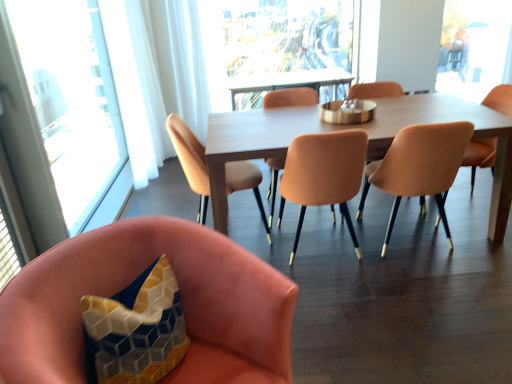
Question: Does matte orange chair at center, which is counted as the 3th chair, starting from the left, lie in front of matte peach armchair at center?

Choices:
 (A) no
 (B) yes

Answer: (B)

Question: Is matte peach armchair at center surrounded by matte orange chair at center, which is counted as the 3th chair, starting from the left?

Choices:
 (A) no
 (B) yes

Answer: (A)

Question: Considering the relative sizes of matte orange chair at center, which is counted as the 3th chair, starting from the left, and matte peach armchair at center in the image provided, is matte orange chair at center, which is counted as the 3th chair, starting from the left, bigger than matte peach armchair at center?

Choices:
 (A) no
 (B) yes

Answer: (A)

Question: Does matte orange chair at center, the 4th chair in the right-to-left sequence, have a greater height compared to matte peach armchair at center?

Choices:
 (A) no
 (B) yes

Answer: (A)

Question: Can you confirm if matte orange chair at center, the 4th chair in the right-to-left sequence, is wider than matte peach armchair at center?

Choices:
 (A) no
 (B) yes

Answer: (A)

Question: In the image, is transparent glass window at left, positioned as the 2th window in right-to-left order, positioned in front of or behind matte orange chair at center, which is counted as the fifth chair, starting from the left?

Choices:
 (A) behind
 (B) front

Answer: (B)

Question: Is transparent glass window at left, the second window positioned from the back, wider or thinner than matte orange chair at center, which is counted as the fifth chair, starting from the left?

Choices:
 (A) thin
 (B) wide

Answer: (A)

Question: Based on their sizes in the image, would you say transparent glass window at left, the first window from the left, is bigger or smaller than matte orange chair at center, which is counted as the fifth chair, starting from the left?

Choices:
 (A) small
 (B) big

Answer: (B)

Question: From a real-world perspective, is transparent glass window at left, the second window positioned from the back, positioned above or below matte orange chair at center, which appears as the second chair when viewed from the right?

Choices:
 (A) above
 (B) below

Answer: (A)

Question: Considering the relative positions of light brown wooden table at center and matte orange chair at center, which is counted as the fifth chair, starting from the left, in the image provided, is light brown wooden table at center to the left or to the right of matte orange chair at center, which is counted as the fifth chair, starting from the left,?

Choices:
 (A) left
 (B) right

Answer: (A)

Question: Is light brown wooden table at center inside or outside of matte orange chair at center, which is counted as the fifth chair, starting from the left?

Choices:
 (A) inside
 (B) outside

Answer: (B)

Question: From the image's perspective, relative to matte orange chair at center, which is counted as the fifth chair, starting from the left, is light brown wooden table at center above or below?

Choices:
 (A) above
 (B) below

Answer: (A)

Question: Is point (207, 157) positioned closer to the camera than point (442, 163)?

Choices:
 (A) farther
 (B) closer

Answer: (A)

Question: From the image's perspective, is matte orange chair at center, which is counted as the 3th chair, starting from the left, above or below matte peach chair at center, marked as the second chair in a left-to-right arrangement?

Choices:
 (A) below
 (B) above

Answer: (B)

Question: Considering the positions of matte orange chair at center, which is counted as the 3th chair, starting from the left, and matte peach chair at center, marked as the second chair in a left-to-right arrangement, in the image, is matte orange chair at center, which is counted as the 3th chair, starting from the left, bigger or smaller than matte peach chair at center, marked as the second chair in a left-to-right arrangement,?

Choices:
 (A) big
 (B) small

Answer: (B)